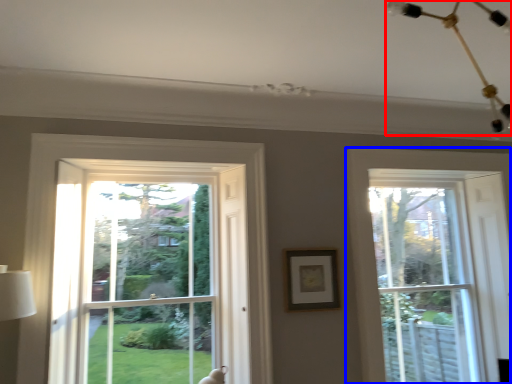
Question: Among these objects, which one is nearest to the camera, light fixture (highlighted by a red box) or window (highlighted by a blue box)?

Choices:
 (A) light fixture
 (B) window

Answer: (A)